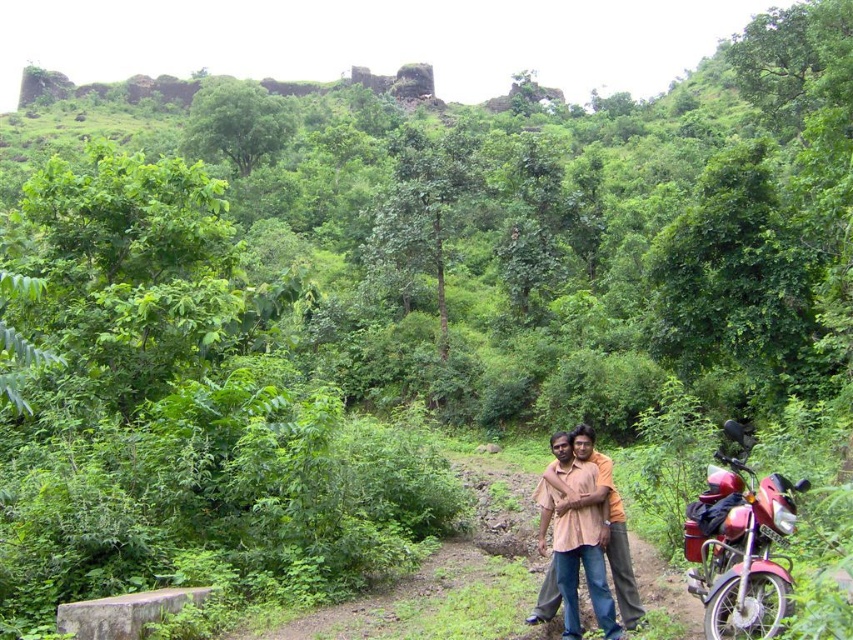
Does metallic red motorcycle at lower right have a lesser width compared to light brown cotton shirt at center?

Correct, metallic red motorcycle at lower right's width is less than light brown cotton shirt at center's.

Which is behind, point (793, 518) or point (599, 458)?

Point (599, 458)

Which is behind, point (769, 634) or point (618, 506)?

The point (618, 506) is more distant.

Where is `metallic red motorcycle at lower right`? The image size is (853, 640). metallic red motorcycle at lower right is located at coordinates (740, 550).